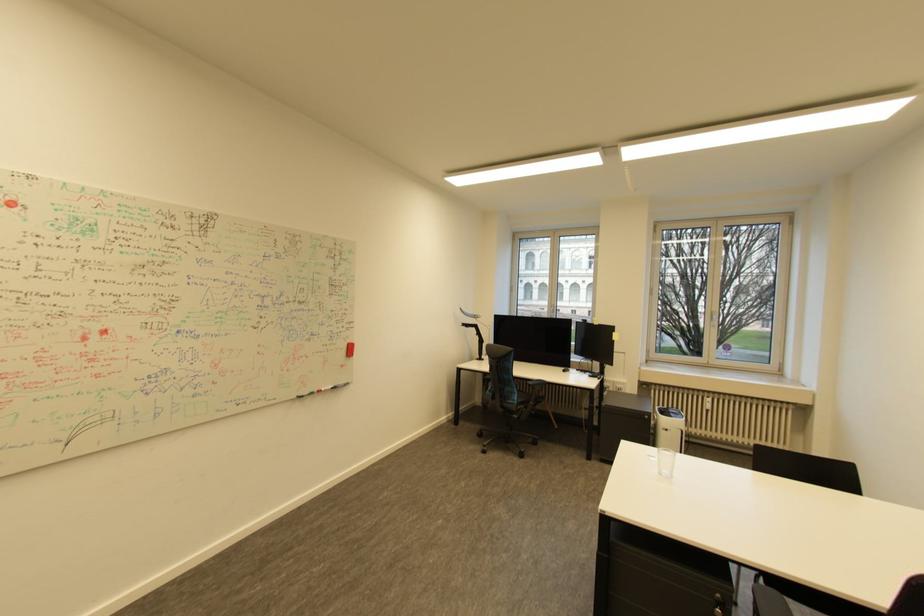
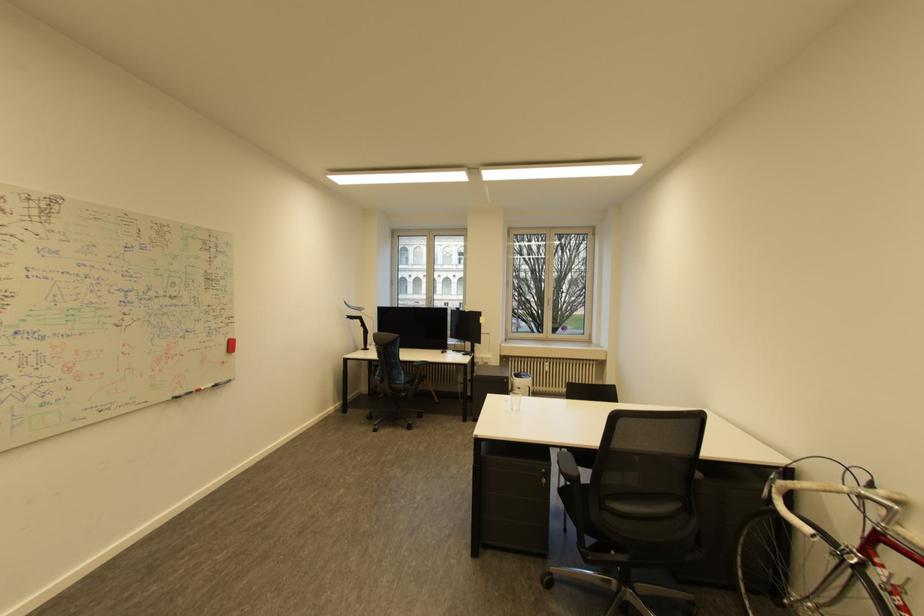
The images are taken continuously from a first-person perspective. In which direction are you moving?

The cameraman walked toward left, backward.